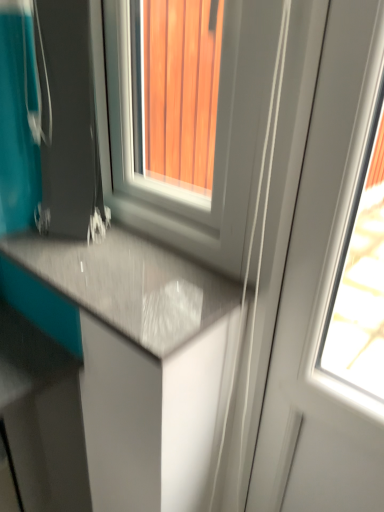
Question: Is point (231, 261) positioned closer to the camera than point (291, 467)?

Choices:
 (A) farther
 (B) closer

Answer: (B)

Question: Looking at their shapes, would you say white glossy window at center is wider or thinner than white glossy screen door at right?

Choices:
 (A) wide
 (B) thin

Answer: (A)

Question: Based on their relative distances, which object is nearer to the white glossy window at center?

Choices:
 (A) white glossy screen door at right
 (B) matte gray countertop at lower left
 (C) matte black suitcase at lower left

Answer: (C)

Question: Estimate the real-world distances between objects in this image. Which object is closer to the white glossy window at center?

Choices:
 (A) matte gray countertop at lower left
 (B) matte black suitcase at lower left
 (C) white glossy screen door at right

Answer: (B)